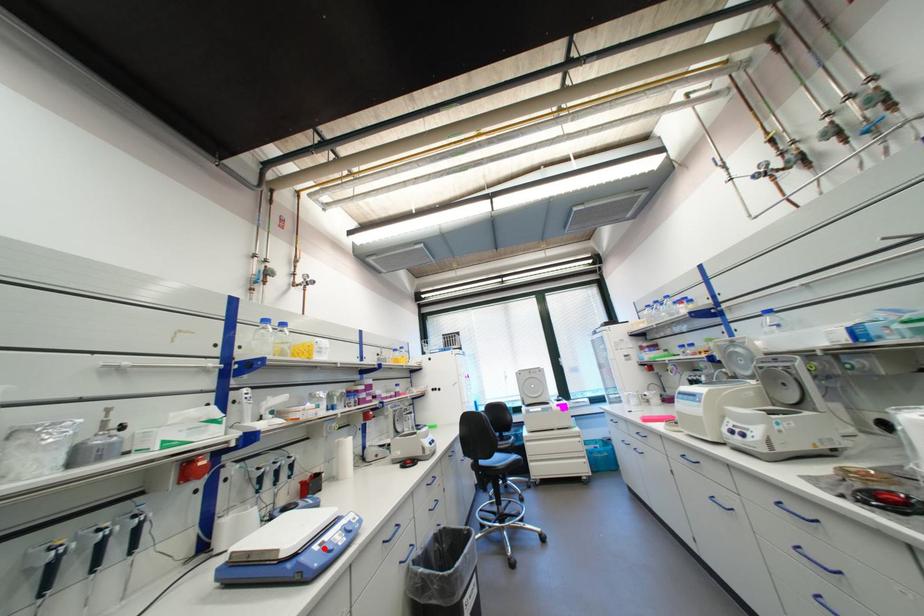
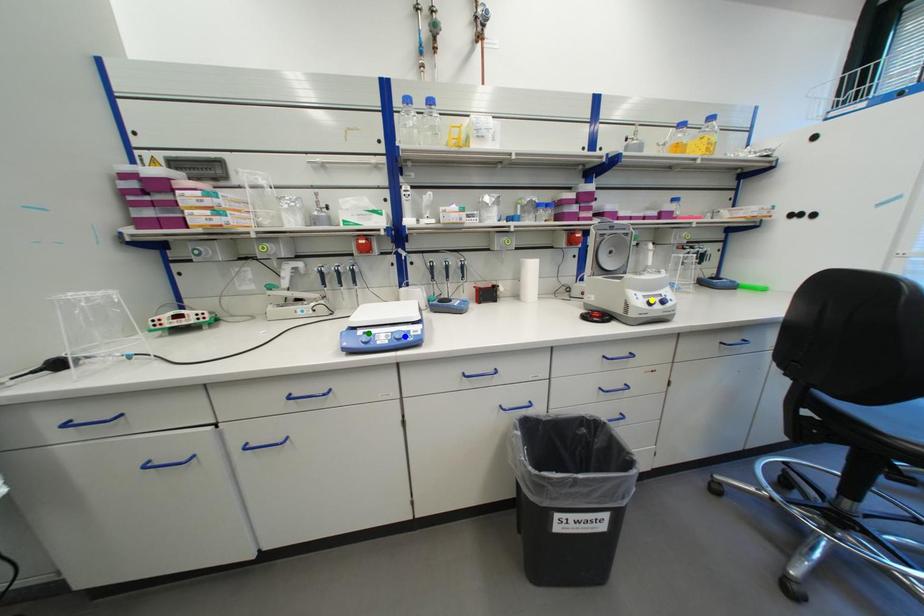
Question: I am providing you with two images of the same scene from different viewpoints. A red point is marked on the first image. You are given multiple points on the second image. Which point in image 2 is actually the same real-world point as the red point in image 1?

Choices:
 (A) yellow point
 (B) blue point
 (C) green point

Answer: (C)